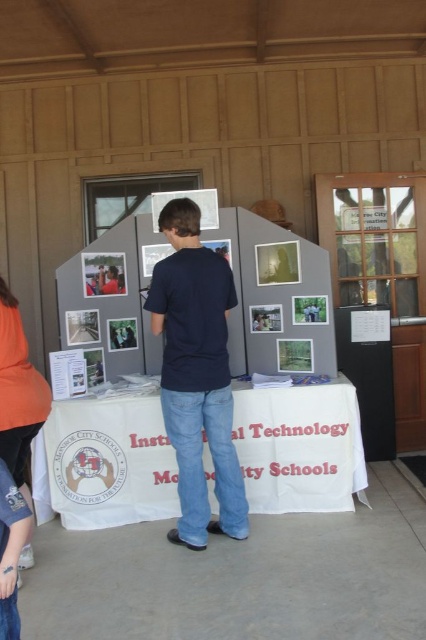
Is dark blue t-shirt at center in front of orange fabric at lower left?

No, dark blue t-shirt at center is behind orange fabric at lower left.

Between point (216, 470) and point (29, 557), which one is positioned behind?

The point (216, 470) is behind.

Is point (184, 353) behind point (13, 378)?

Yes, it is.

This screenshot has height=640, width=426. In order to click on dark blue t-shirt at center in this screenshot , I will do [196, 374].

Can you confirm if matte gray posterboard at center is positioned above orange fabric at lower left?

Indeed, matte gray posterboard at center is positioned over orange fabric at lower left.

The image size is (426, 640). In order to click on matte gray posterboard at center in this screenshot , I will do `click(273, 292)`.

Identify the location of matte gray posterboard at center. The image size is (426, 640). (273, 292).

Can you confirm if matte gray posterboard at center is wider than dark blue t-shirt at center?

Yes.

Does matte gray posterboard at center appear on the left side of dark blue t-shirt at center?

No, matte gray posterboard at center is not to the left of dark blue t-shirt at center.

At what (x,y) coordinates should I click in order to perform the action: click on matte gray posterboard at center. Please return your answer as a coordinate pair (x, y). This screenshot has height=640, width=426. Looking at the image, I should click on (273, 292).

Image resolution: width=426 pixels, height=640 pixels. I want to click on matte gray posterboard at center, so click(x=273, y=292).